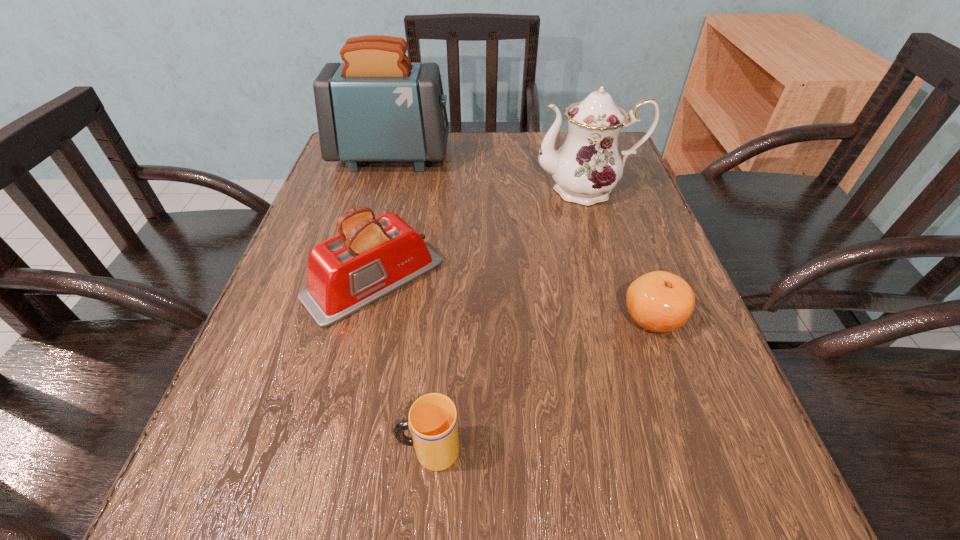
Locate an element on the screen. object identified as the third closest to the clementine is located at coordinates (371, 257).

I want to click on vacant point that satisfies the following two spatial constraints: 1. on the side of the nearest object with the handle; 2. on the front-facing side of the farther toaster, so click(453, 157).

Identify the location of vacant space that satisfies the following two spatial constraints: 1. on the back side of the clementine; 2. on the front-facing side of the taller toaster. The image size is (960, 540). (596, 157).

At what (x,y) coordinates should I click in order to perform the action: click on free space that satisfies the following two spatial constraints: 1. on the back side of the third tallest object; 2. on the front-facing side of the taller toaster. Please return your answer as a coordinate pair (x, y). Looking at the image, I should click on (403, 157).

The width and height of the screenshot is (960, 540). Find the location of `free location that satisfies the following two spatial constraints: 1. on the side of the nearest object with the handle; 2. on the front-facing side of the farther toaster`. free location that satisfies the following two spatial constraints: 1. on the side of the nearest object with the handle; 2. on the front-facing side of the farther toaster is located at coordinates (453, 157).

Find the location of a particular element. The width and height of the screenshot is (960, 540). vacant space that satisfies the following two spatial constraints: 1. on the side of the cup with the handle; 2. on the front-facing side of the farther toaster is located at coordinates (453, 157).

Where is `vacant space that satisfies the following two spatial constraints: 1. on the back side of the third shortest object; 2. on the right side of the second tallest object`? This screenshot has height=540, width=960. vacant space that satisfies the following two spatial constraints: 1. on the back side of the third shortest object; 2. on the right side of the second tallest object is located at coordinates (396, 190).

I want to click on free spot that satisfies the following two spatial constraints: 1. on the back side of the chinaware; 2. on the left side of the third shortest object, so click(x=396, y=190).

In order to click on vacant area in the image that satisfies the following two spatial constraints: 1. on the front-facing side of the farther toaster; 2. on the left side of the clementine in this screenshot , I will do `click(348, 318)`.

Where is `blank space that satisfies the following two spatial constraints: 1. on the front-facing side of the farther toaster; 2. on the back side of the third tallest object`? blank space that satisfies the following two spatial constraints: 1. on the front-facing side of the farther toaster; 2. on the back side of the third tallest object is located at coordinates tap(357, 280).